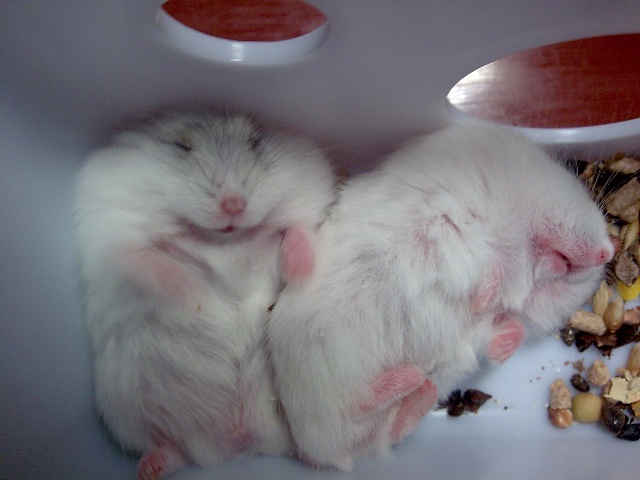
Locate an element on the screen. floor is located at coordinates (534, 452).